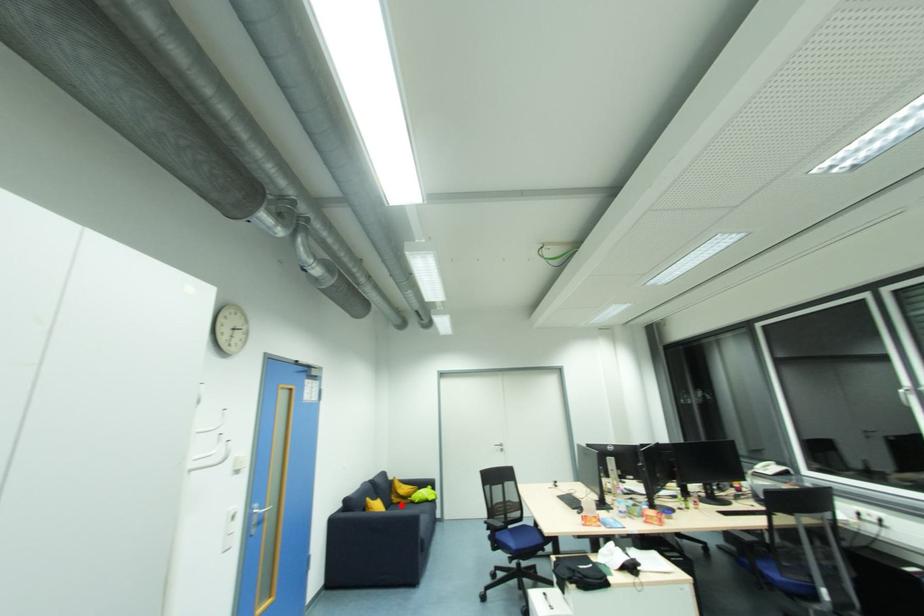
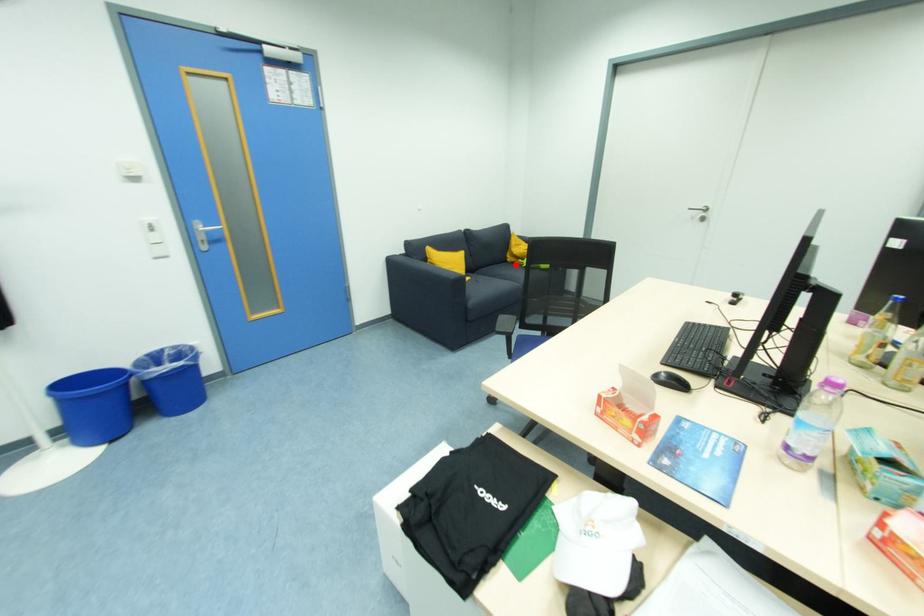
I am providing you with two images of the same scene from different viewpoints. A red point is marked on the first image and another point is marked on the second image. Does the point marked in image1 correspond to the same location as the one in image2?

Yes